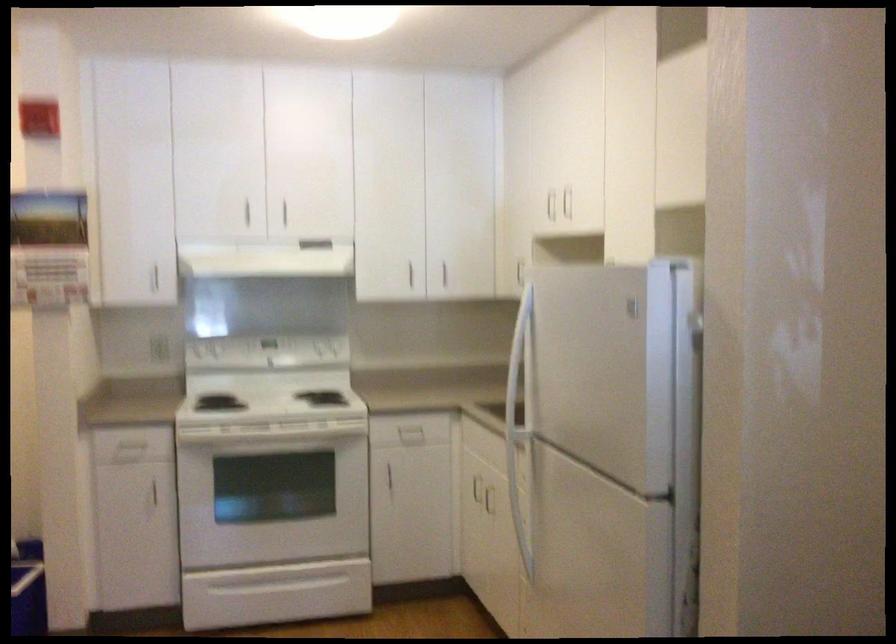
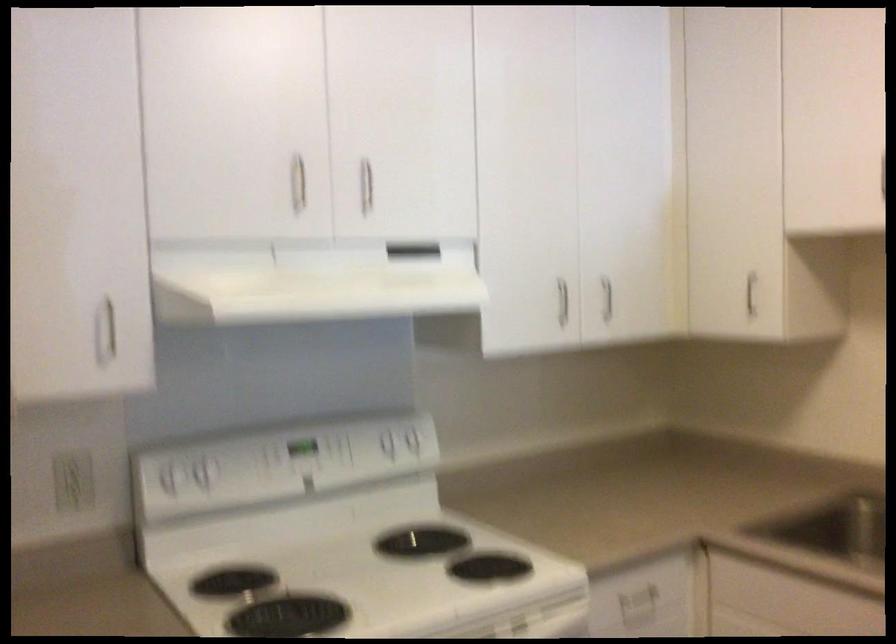
In the second image, find the point that corresponds to (159,346) in the first image.

(73, 480)